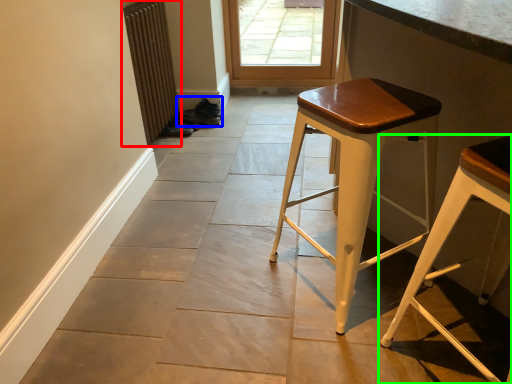
Question: Based on their relative distances, which object is farther from radiator (highlighted by a red box)? Choose from shoe (highlighted by a blue box) and stool (highlighted by a green box).

Choices:
 (A) shoe
 (B) stool

Answer: (B)